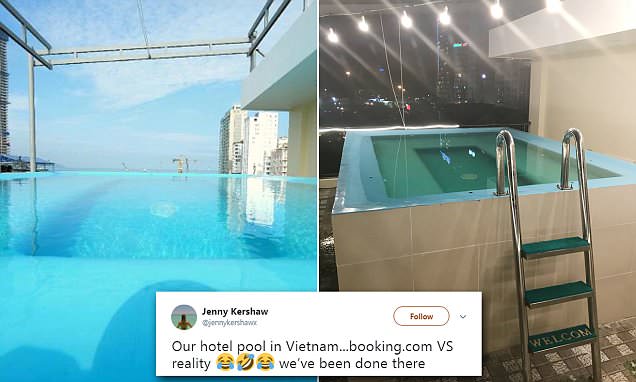
Identify the location of ladder. (553, 240).